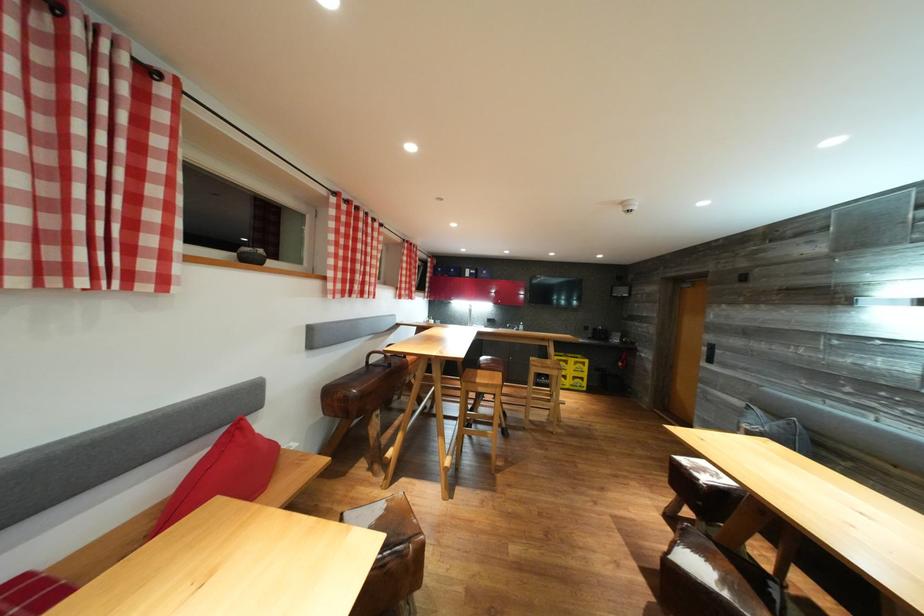
The image size is (924, 616). Describe the element at coordinates (719, 564) in the screenshot. I see `a leather bench surface` at that location.